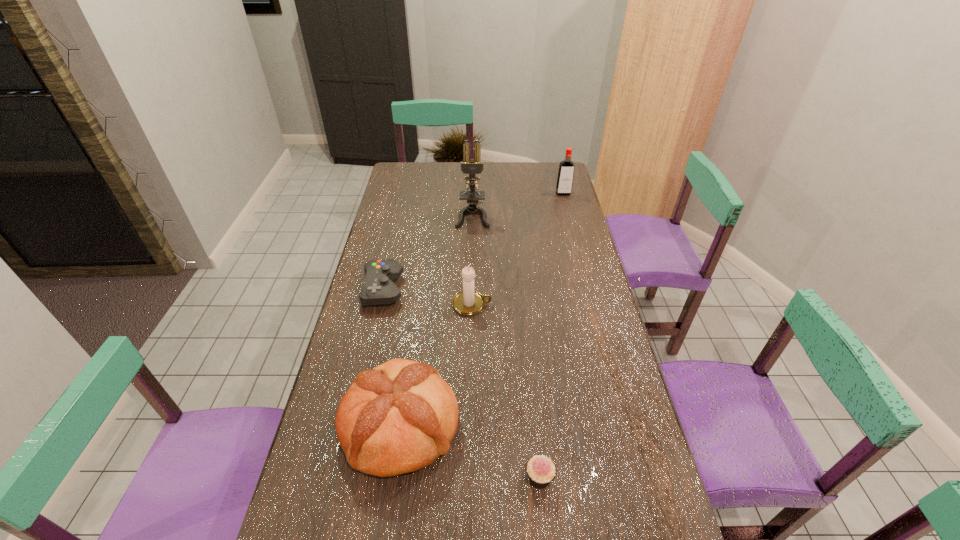
Locate an element on the screen. the tallest object is located at coordinates (469, 166).

The width and height of the screenshot is (960, 540). I want to click on microscope, so click(469, 166).

The image size is (960, 540). What are the coordinates of `vodka` in the screenshot? It's located at (565, 176).

At what (x,y) coordinates should I click in order to perform the action: click on the second tallest object. Please return your answer as a coordinate pair (x, y). The width and height of the screenshot is (960, 540). Looking at the image, I should click on (565, 176).

This screenshot has height=540, width=960. I want to click on candle holder, so click(x=467, y=302).

Image resolution: width=960 pixels, height=540 pixels. Identify the location of bread. (399, 417).

This screenshot has width=960, height=540. Find the location of `cupcake`. cupcake is located at coordinates (541, 470).

Locate an element on the screen. The image size is (960, 540). control is located at coordinates (379, 288).

The image size is (960, 540). In order to click on free space located at the eyepieces of the microscope in this screenshot , I will do `click(472, 253)`.

The image size is (960, 540). I want to click on vacant region located 0.120m on the front and back of the fifth shortest object, so click(x=567, y=211).